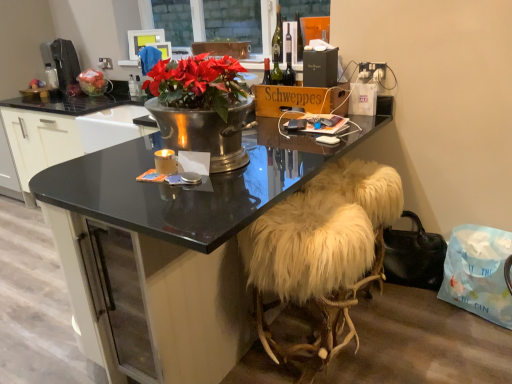
Question: Considering the relative sizes of metallic silver sink at center and matte plastic television at upper center in the image provided, is metallic silver sink at center bigger than matte plastic television at upper center?

Choices:
 (A) yes
 (B) no

Answer: (A)

Question: From the image's perspective, is metallic silver sink at center below matte plastic television at upper center?

Choices:
 (A) no
 (B) yes

Answer: (B)

Question: Does metallic silver sink at center have a lesser height compared to matte plastic television at upper center?

Choices:
 (A) no
 (B) yes

Answer: (A)

Question: Does metallic silver sink at center appear on the right side of matte plastic television at upper center?

Choices:
 (A) no
 (B) yes

Answer: (A)

Question: Does metallic silver sink at center have a smaller size compared to matte plastic television at upper center?

Choices:
 (A) no
 (B) yes

Answer: (A)

Question: Is metallic silver sink at center in contact with matte plastic television at upper center?

Choices:
 (A) yes
 (B) no

Answer: (B)

Question: Would you say black plastic coffee machine at left contains matte plastic television at upper center?

Choices:
 (A) no
 (B) yes

Answer: (A)

Question: From a real-world perspective, does black plastic coffee machine at left sit lower than matte plastic television at upper center?

Choices:
 (A) yes
 (B) no

Answer: (A)

Question: Is black plastic coffee machine at left not close to matte plastic television at upper center?

Choices:
 (A) no
 (B) yes

Answer: (A)

Question: Is black plastic coffee machine at left to the left of matte plastic television at upper center from the viewer's perspective?

Choices:
 (A) no
 (B) yes

Answer: (B)

Question: Is black plastic coffee machine at left facing towards matte plastic television at upper center?

Choices:
 (A) yes
 (B) no

Answer: (B)

Question: From the image's perspective, would you say black plastic coffee machine at left is positioned over matte plastic television at upper center?

Choices:
 (A) no
 (B) yes

Answer: (A)

Question: From a real-world perspective, is clear glass window at upper center under white plastic power outlet at upper center?

Choices:
 (A) yes
 (B) no

Answer: (B)